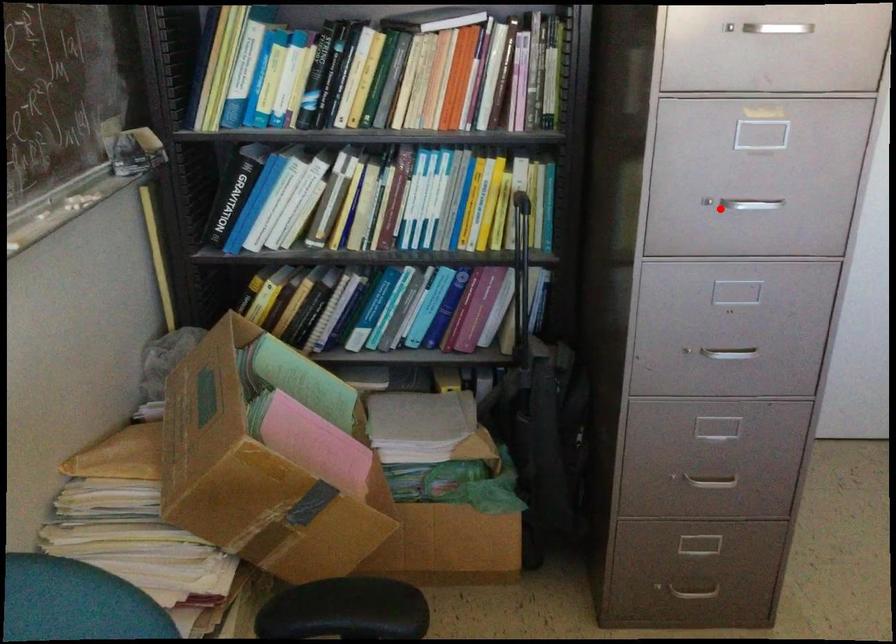
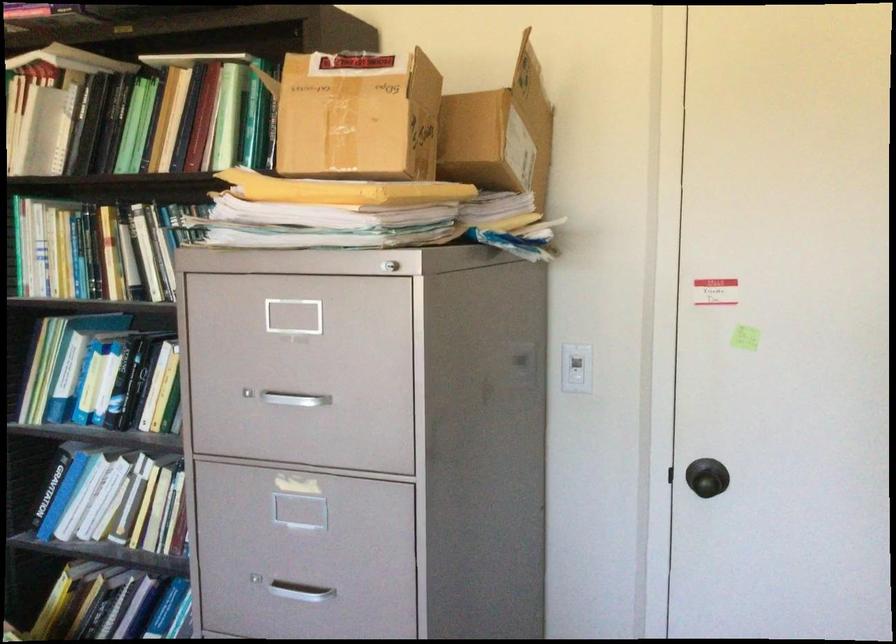
Question: I am providing you with two images of the same scene from different viewpoints. Given a red point in image1, look at the same physical point in image2. Is it:

Choices:
 (A) Closer to the viewpoint
 (B) Farther from the viewpoint

Answer: (A)